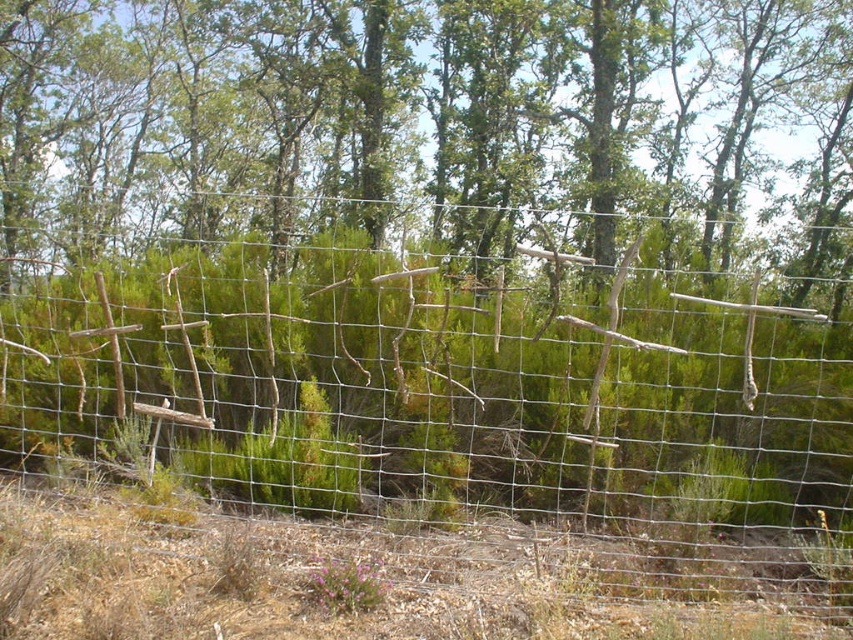
You are a gardener planning to plant a new tree in the area behind the wire mesh fence at center and the green leafy tree at center. Considering their sizes, which object would you need to consider for space availability?

The wire mesh fence at center has a smaller size compared to the green leafy tree at center, so you should consider the space required for the green leafy tree at center more carefully.

You are standing in front of a rustic wire fence with wooden stakes. There is a specific point at coordinates (x=451, y=404) that you need to locate. Based on the scene description, what object is at this point?

The point at coordinates (x=451, y=404) corresponds to the wire mesh fence at center.